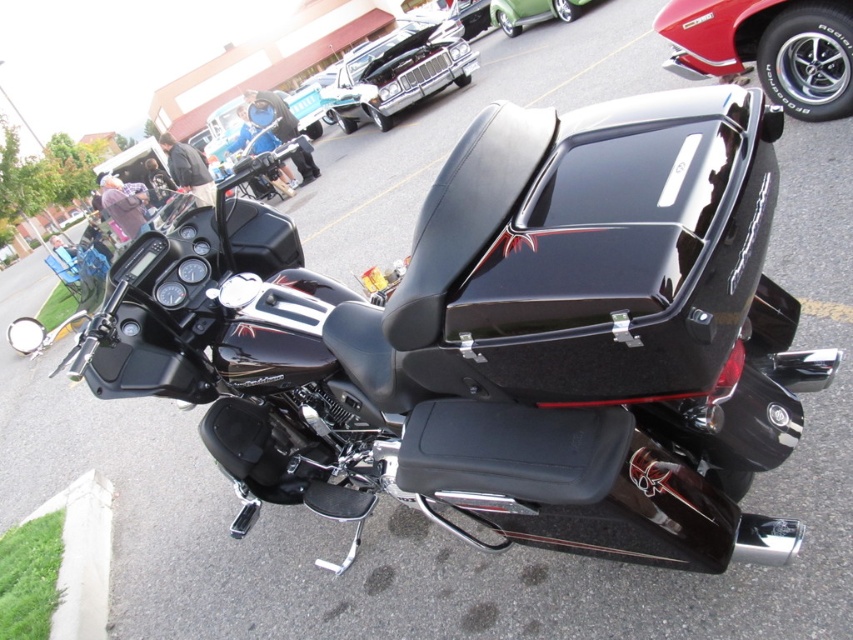
Question: Is green grass at lower left below green glossy car at upper center?

Choices:
 (A) yes
 (B) no

Answer: (A)

Question: Observing the image, what is the correct spatial positioning of glossy red car at upper right in reference to shiny chrome car at upper center?

Choices:
 (A) below
 (B) above

Answer: (A)

Question: Does glossy red car at upper right lie behind green grass at lower left?

Choices:
 (A) yes
 (B) no

Answer: (A)

Question: Estimate the real-world distances between objects in this image. Which object is closer to the glossy red car at upper right?

Choices:
 (A) green glossy car at upper center
 (B) green grass at lower left
 (C) shiny chrome car at upper center

Answer: (B)

Question: Considering the real-world distances, which object is closest to the glossy red car at upper right?

Choices:
 (A) green grass at lower left
 (B) green glossy car at upper center

Answer: (A)

Question: Which of the following is the farthest from the observer?

Choices:
 (A) green glossy car at upper center
 (B) glossy red car at upper right
 (C) green grass at lower left

Answer: (A)